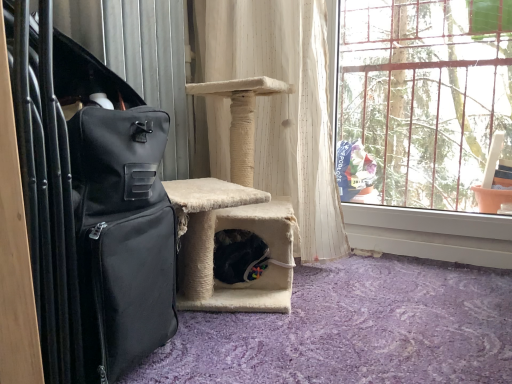
I want to click on free point below clear glass window at upper right (from a real-world perspective), so click(x=410, y=252).